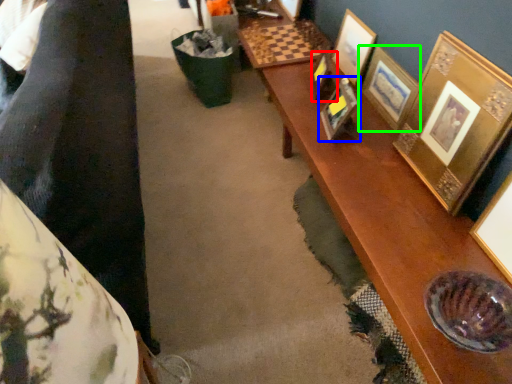
Question: Estimate the real-world distances between objects in this image. Which object is farther from picture frame (highlighted by a red box), picture frame (highlighted by a blue box) or picture frame (highlighted by a green box)?

Choices:
 (A) picture frame
 (B) picture frame

Answer: (B)